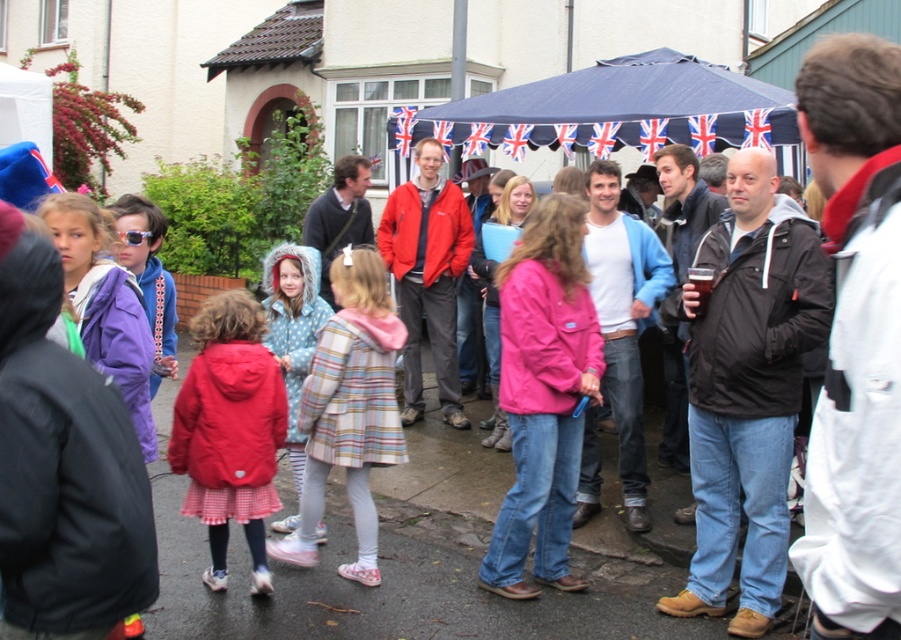
Question: Which object is the closest to the blue fabric canopy at center?

Choices:
 (A) matte red jacket at center
 (B) polka dot hooded coat at center

Answer: (B)

Question: Is blue fabric canopy at center positioned in front of matte red jacket at center?

Choices:
 (A) no
 (B) yes

Answer: (A)

Question: Which point is farther from the camera taking this photo?

Choices:
 (A) (290, 371)
 (B) (675, 76)

Answer: (B)

Question: Is matte red jacket at center positioned before polka dot hooded coat at center?

Choices:
 (A) yes
 (B) no

Answer: (A)

Question: Which object is positioned closest to the polka dot hooded coat at center?

Choices:
 (A) matte red jacket at center
 (B) blue fabric canopy at center

Answer: (A)

Question: Can you confirm if blue fabric canopy at center is positioned below matte red jacket at center?

Choices:
 (A) no
 (B) yes

Answer: (A)